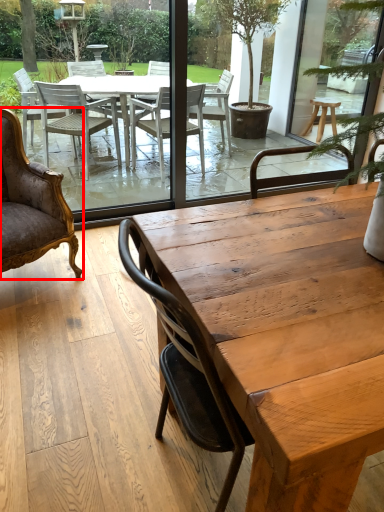
Question: From the image's perspective, where is chair (annotated by the red box) located in relation to coffee table in the image?

Choices:
 (A) above
 (B) below

Answer: (A)